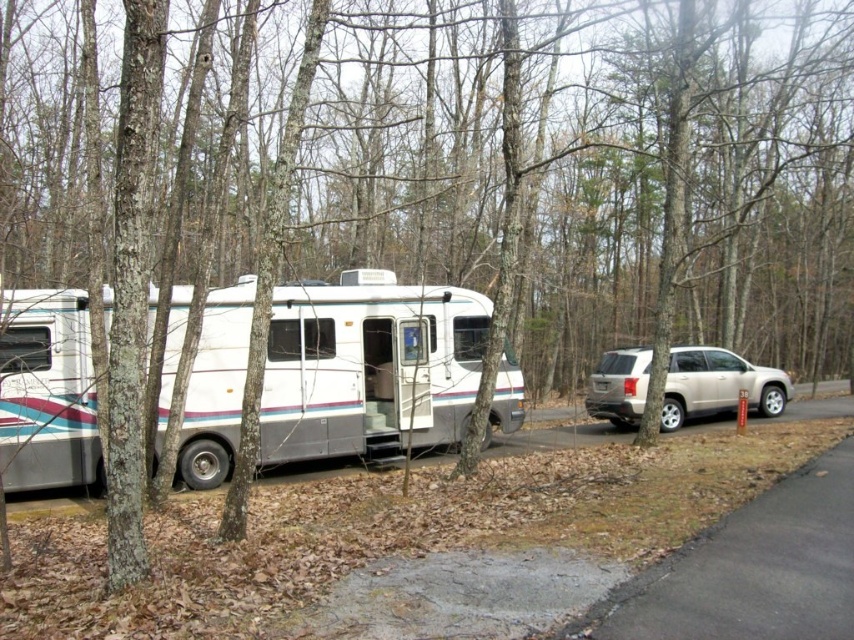
You are planning to park your car next to the white glossy recreational vehicle at center and the satin gold suv at right. Based on their widths, which vehicle should you park closer to if you want to maximize the available space between your car and the other vehicles?

The white glossy recreational vehicle at center has a lesser width compared to the satin gold suv at right. Therefore, you should park closer to the white glossy recreational vehicle at center to maximize the available space between your car and the other vehicles.

Based on the photo, you are planning to park your car in this campground. You see a white glossy recreational vehicle at center and a satin gold suv at right. Which vehicle is larger in size?

The satin gold suv at right is larger than the white glossy recreational vehicle at center according to the description.

You are planning to park your car in the campground and want to know the position of the white glossy recreational vehicle at center relative to the satin gold suv at right. Can you tell me which one is on the left side?

The white glossy recreational vehicle at center is to the left of the satin gold suv at right.